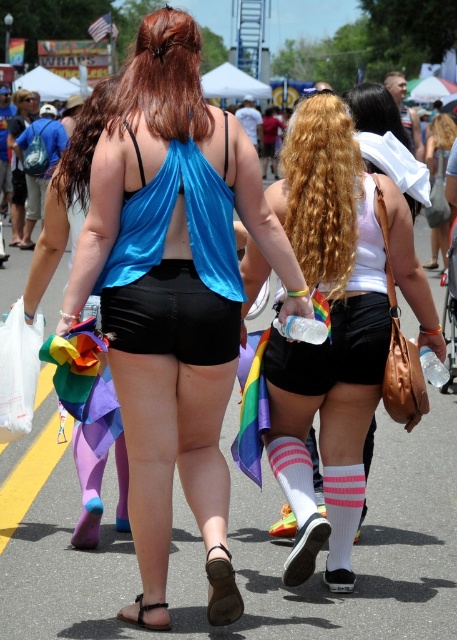
Question: Can you confirm if curly blonde hair at center is positioned above black matte shorts at center?

Choices:
 (A) yes
 (B) no

Answer: (A)

Question: Among these objects, which one is farthest from the camera?

Choices:
 (A) curly blonde hair at center
 (B) blue satin tank top at center

Answer: (A)

Question: Does white matte tank top at center appear under curly blonde hair at upper center?

Choices:
 (A) yes
 (B) no

Answer: (A)

Question: From the image, what is the correct spatial relationship of curly blonde hair at center in relation to black matte shorts at center?

Choices:
 (A) right
 (B) left

Answer: (A)

Question: Which object is positioned closest to the black matte shorts at center?

Choices:
 (A) curly blonde hair at center
 (B) blue satin tank top at center
 (C) curly blonde hair at upper center
 (D) white matte tank top at center

Answer: (B)

Question: Which point is farther to the camera?

Choices:
 (A) white matte tank top at center
 (B) curly blonde hair at upper center

Answer: (B)